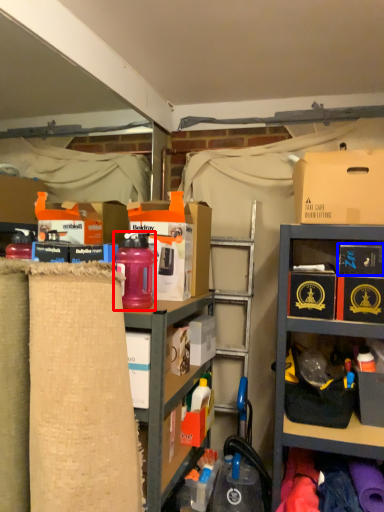
Question: Which of the following is the farthest to the observer, bottle (highlighted by a red box) or storage box (highlighted by a blue box)?

Choices:
 (A) bottle
 (B) storage box

Answer: (B)